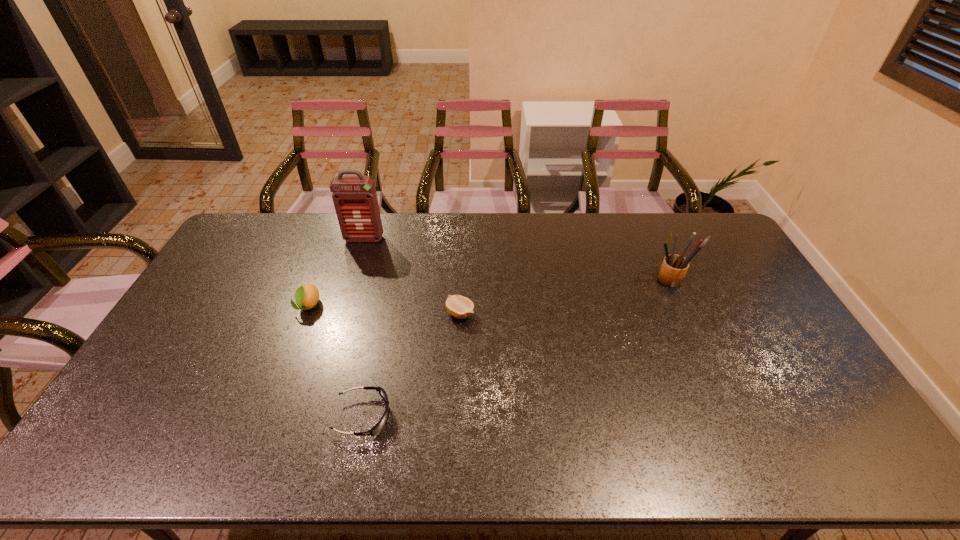
The width and height of the screenshot is (960, 540). What are the coordinates of `free space between the second farthest object and the goggles` in the screenshot? It's located at (516, 348).

Locate an element on the screen. This screenshot has width=960, height=540. free space between the left lemon and the nearest object is located at coordinates (336, 361).

Locate an element on the screen. free spot between the left lemon and the goggles is located at coordinates click(x=336, y=361).

You are a GUI agent. You are given a task and a screenshot of the screen. Output one action in this format:
    pyautogui.click(x=<x>, y=<y>)
    Task: Click on the free space that is in between the nearest object and the leftmost object
    This screenshot has width=960, height=540.
    Given the screenshot: What is the action you would take?
    pyautogui.click(x=336, y=361)

Locate an element on the screen. free space between the goggles and the farthest object is located at coordinates (364, 327).

Where is `empty space between the fourth shortest object and the right lemon`? This screenshot has height=540, width=960. empty space between the fourth shortest object and the right lemon is located at coordinates (564, 297).

Where is `blank region between the right lemon and the nearest object`? blank region between the right lemon and the nearest object is located at coordinates (412, 365).

This screenshot has width=960, height=540. Identify the location of empty location between the goggles and the shorter lemon. (412, 365).

This screenshot has width=960, height=540. In order to click on vacant point located between the fourth object from left to right and the leftmost object in this screenshot , I will do `click(384, 309)`.

Identify the location of vacant area between the tallest object and the right lemon. The image size is (960, 540). (412, 276).